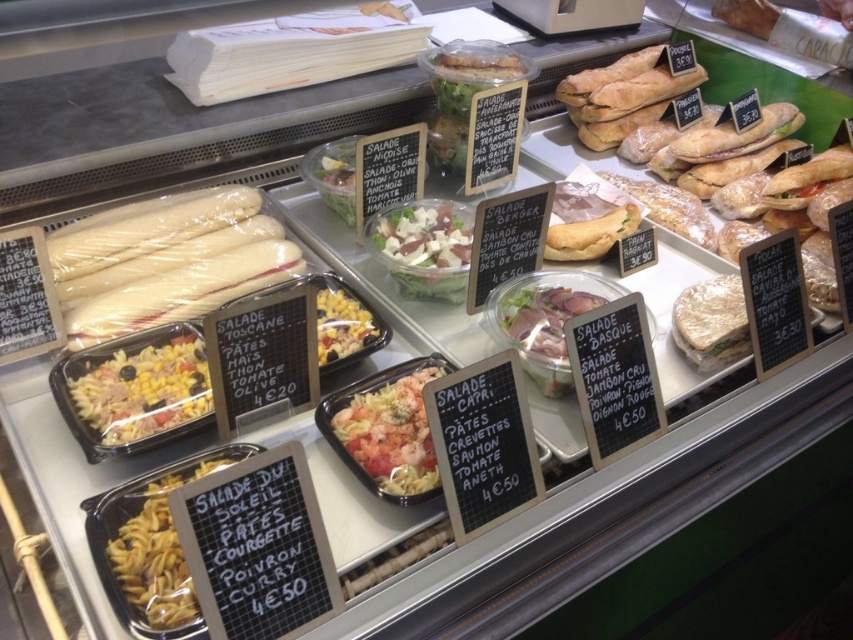
Question: Which point is closer to the camera?

Choices:
 (A) yellow matte pasta at lower left
 (B) green leafy salad at center
 (C) white paper sandwich at center-right

Answer: (A)

Question: Can you confirm if yellowish matte pasta at left is thinner than matte brown salad at center?

Choices:
 (A) no
 (B) yes

Answer: (B)

Question: Which point is farther from the camera taking this photo?

Choices:
 (A) (438, 240)
 (B) (149, 432)
 (C) (317, 321)

Answer: (A)

Question: Based on their relative distances, which object is farther from the yellowish matte pasta at left?

Choices:
 (A) shiny plastic container of pasta salad at center
 (B) yellow matte pasta at lower left
 (C) green leafy salad at center
 (D) white paper sandwich at center-right

Answer: (D)

Question: Is green leafy salad at center closer to camera compared to shiny metallic salad bowl at center?

Choices:
 (A) yes
 (B) no

Answer: (B)

Question: Is green leafy salad at center below shiny metallic salad bowl at center?

Choices:
 (A) no
 (B) yes

Answer: (A)